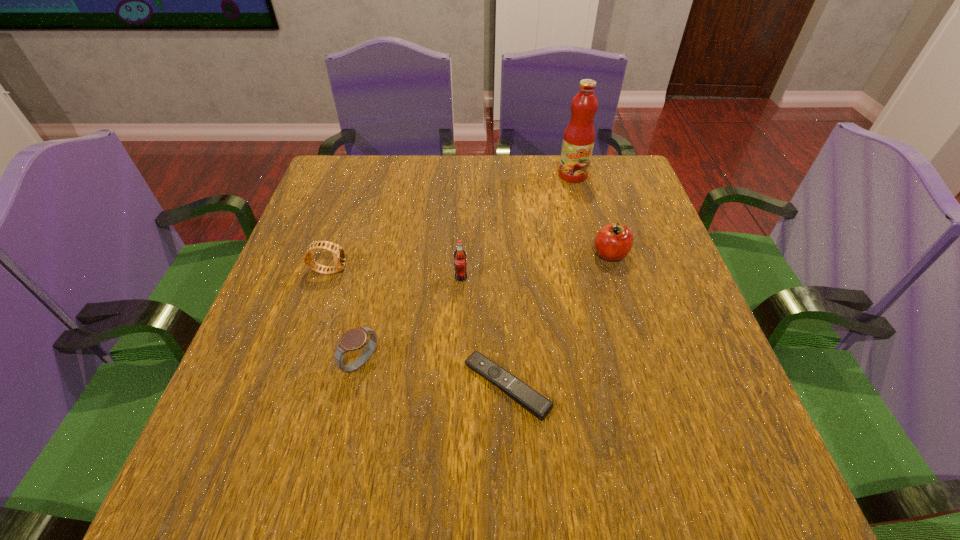
Where is `free space located 0.360m on the label of the soda bottle`? free space located 0.360m on the label of the soda bottle is located at coordinates point(454,443).

You are a GUI agent. You are given a task and a screenshot of the screen. Output one action in this format:
    pyautogui.click(x=<x>, y=<y>)
    Task: Click on the free space located 0.120m on the back of the apple
    The image size is (960, 540).
    Given the screenshot: What is the action you would take?
    pyautogui.click(x=597, y=212)

Where is `vacant area situated 0.240m on the face of the farther watch`? The image size is (960, 540). vacant area situated 0.240m on the face of the farther watch is located at coordinates (453, 270).

Image resolution: width=960 pixels, height=540 pixels. Identify the location of free space located 0.300m on the right of the fifth object from right to left. pos(540,363).

This screenshot has height=540, width=960. I want to click on vacant position located 0.150m on the right of the remote control, so click(x=634, y=386).

Where is `object situated at the far edge`? object situated at the far edge is located at coordinates (578, 141).

Find the location of a particular element. This screenshot has height=540, width=960. object that is positioned at the left edge is located at coordinates (337, 251).

The height and width of the screenshot is (540, 960). In order to click on fruit juice that is at the right edge in this screenshot , I will do 578,141.

Locate an element on the screen. This screenshot has width=960, height=540. apple located at the right edge is located at coordinates (613, 242).

I want to click on object that is at the far right corner, so click(578, 141).